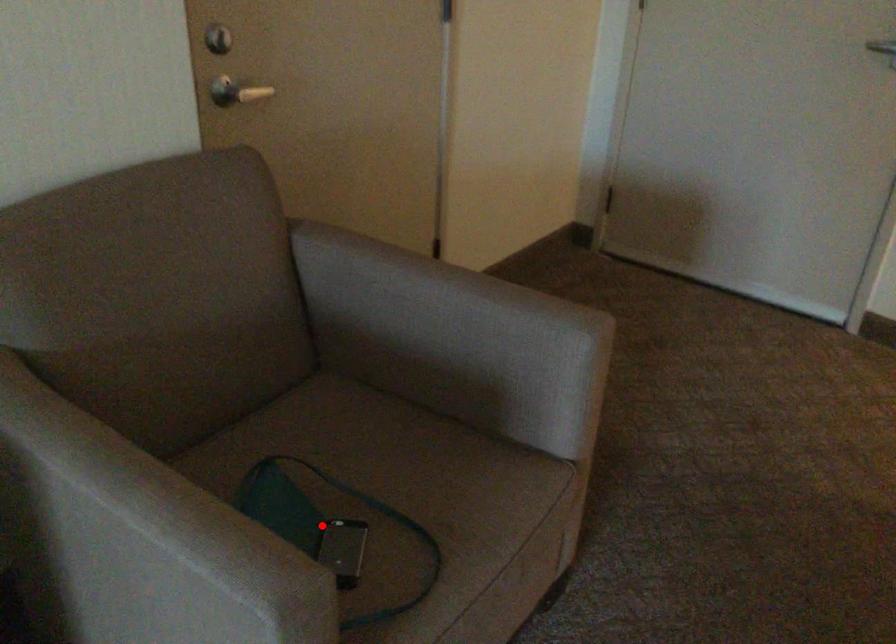
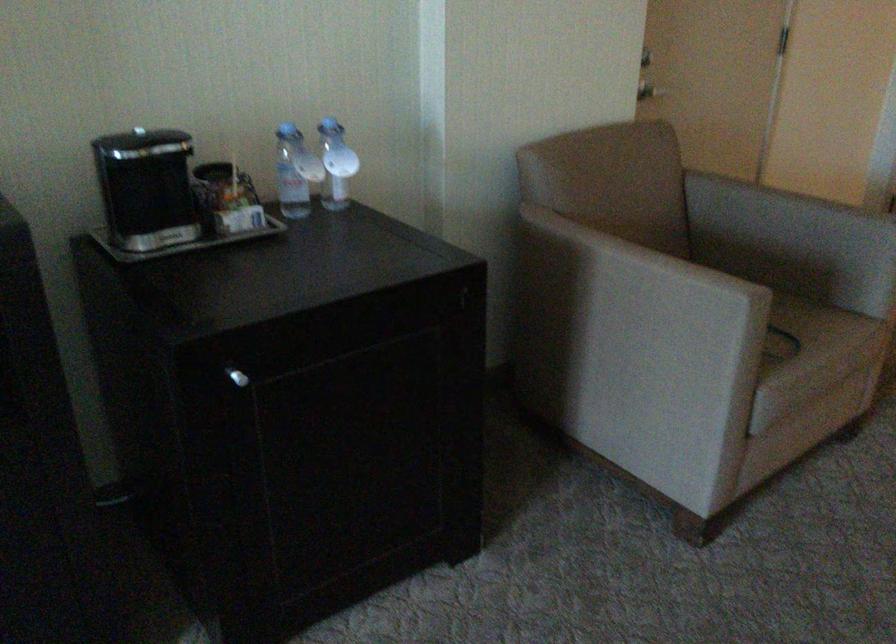
Question: I am providing you with two images of the same scene from different viewpoints. A red point is marked on the first image. Is the red point's position out of view in image 2?

Choices:
 (A) Yes
 (B) No

Answer: (A)